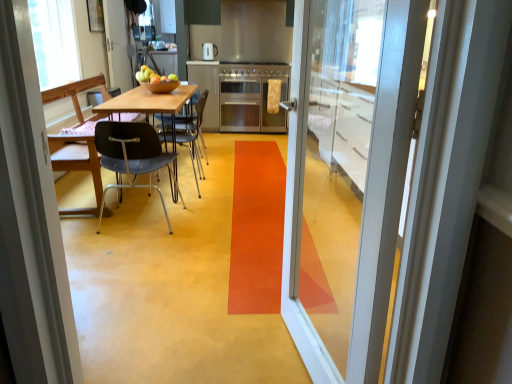
This screenshot has height=384, width=512. Find the location of `free point to the right of black plastic chair at left, which is the third chair in left-to-right order`. free point to the right of black plastic chair at left, which is the third chair in left-to-right order is located at coordinates (227, 185).